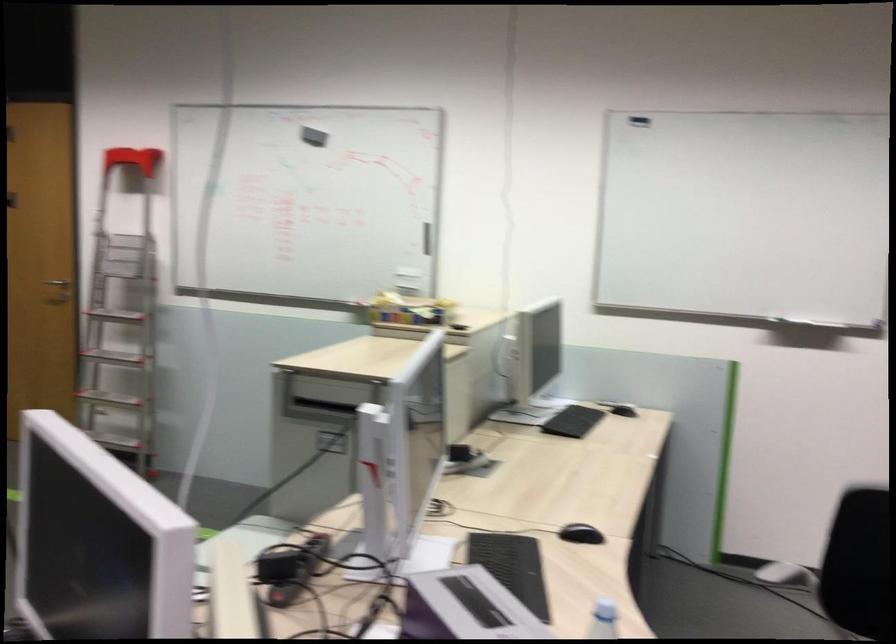
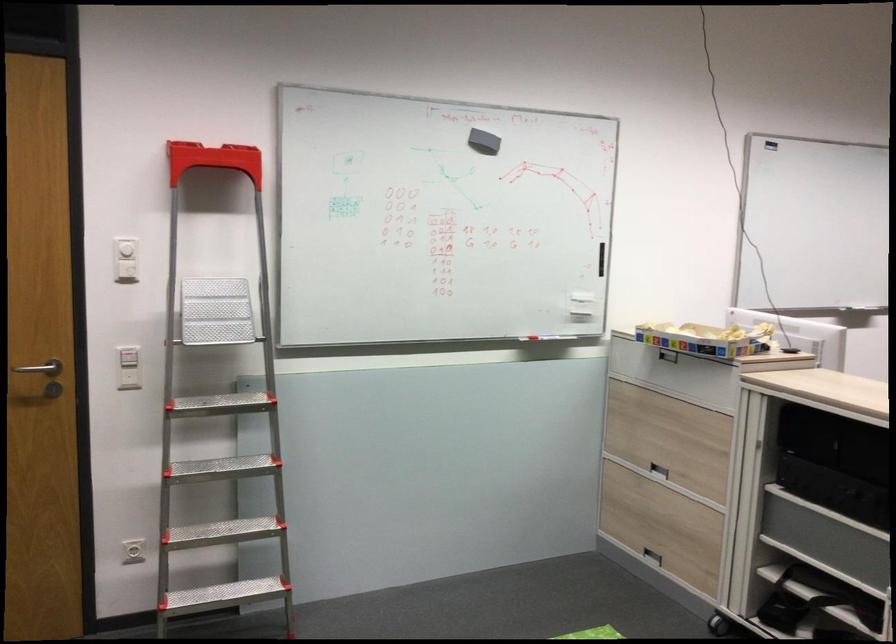
In the second image, find the point that corresponds to (149,286) in the first image.

(128, 377)